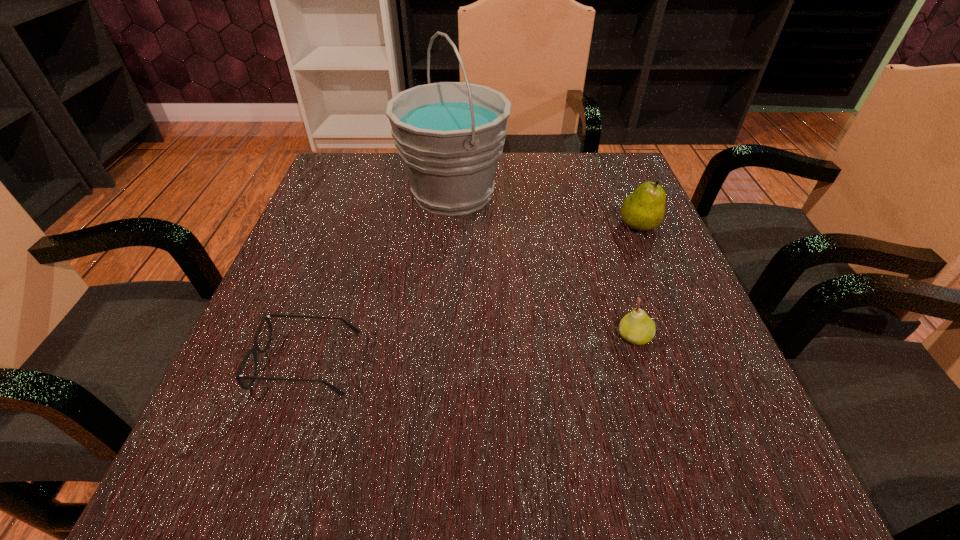
Identify which object is the nearest to the rightmost object. Please provide its 2D coordinates. Your answer should be formatted as a tuple, i.e. [(x, y)], where the tuple contains the x and y coordinates of a point satisfying the conditions above.

[(450, 135)]